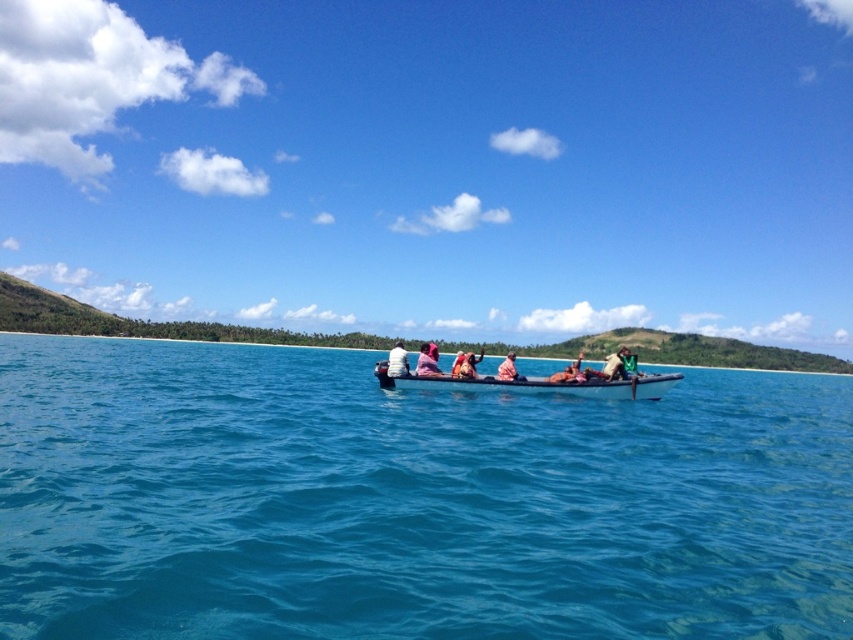
Does dark gray wooden canoe at center appear over green fabric person at center?

Yes.

Can you confirm if dark gray wooden canoe at center is bigger than green fabric person at center?

Actually, dark gray wooden canoe at center might be smaller than green fabric person at center.

Which is behind, point (392, 380) or point (637, 374)?

Point (637, 374)

Identify the location of dark gray wooden canoe at center. The height and width of the screenshot is (640, 853). (537, 385).

Which is behind, point (505, 371) or point (624, 376)?

Positioned behind is point (505, 371).

How much distance is there between light pink fabric at center and green fabric person at center?

light pink fabric at center is 58.55 feet from green fabric person at center.

Which is in front, point (502, 378) or point (624, 376)?

Point (624, 376) is in front.

Where is `light pink fabric at center`? This screenshot has height=640, width=853. light pink fabric at center is located at coordinates (509, 369).

Does white fabric at center have a smaller size compared to green fabric person at center?

Yes, white fabric at center is smaller than green fabric person at center.

Is white fabric at center wider than green fabric person at center?

No, white fabric at center is not wider than green fabric person at center.

At what (x,y) coordinates should I click in order to perform the action: click on white fabric at center. Please return your answer as a coordinate pair (x, y). The image size is (853, 640). Looking at the image, I should click on pos(397,362).